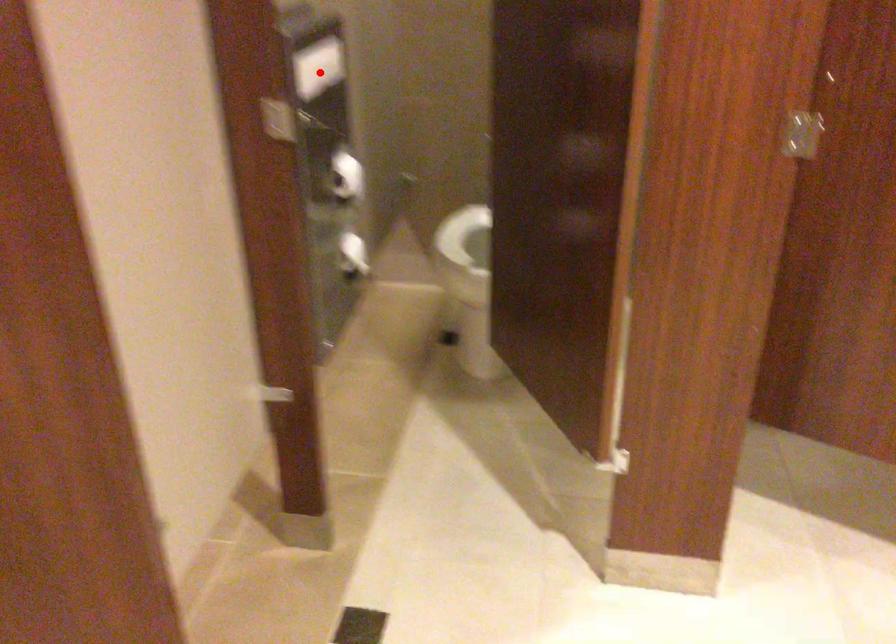
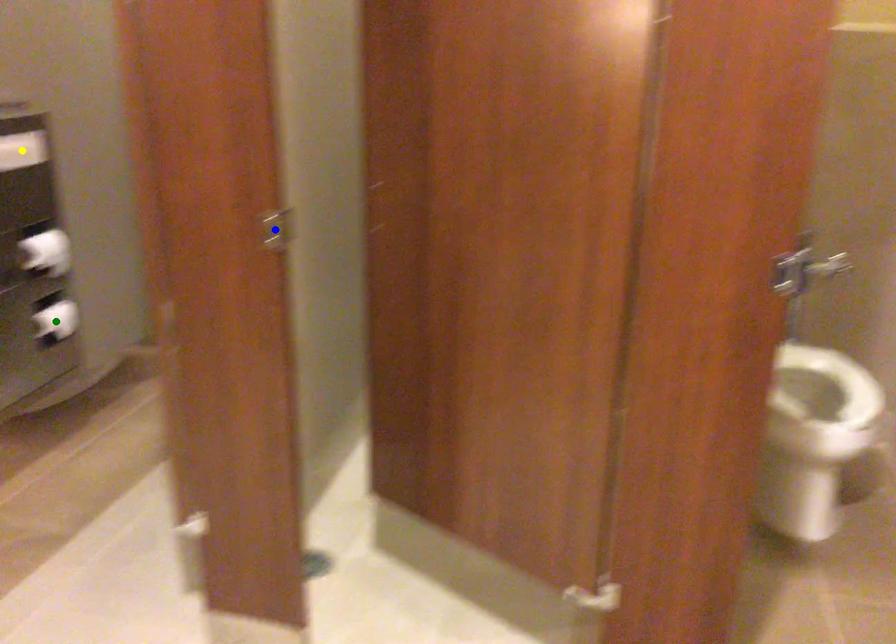
Question: I am providing you with two images of the same scene from different viewpoints. A red point is marked on the first image. You are given multiple points on the second image. Can you choose the point in image 2 that corresponds to the point in image 1?

Choices:
 (A) yellow point
 (B) green point
 (C) blue point

Answer: (A)